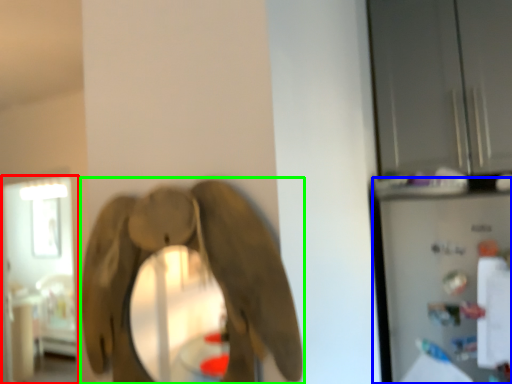
Question: Which is farther away from glass door (highlighted by a red box)? appliance (highlighted by a blue box) or elephant (highlighted by a green box)?

Choices:
 (A) appliance
 (B) elephant

Answer: (B)